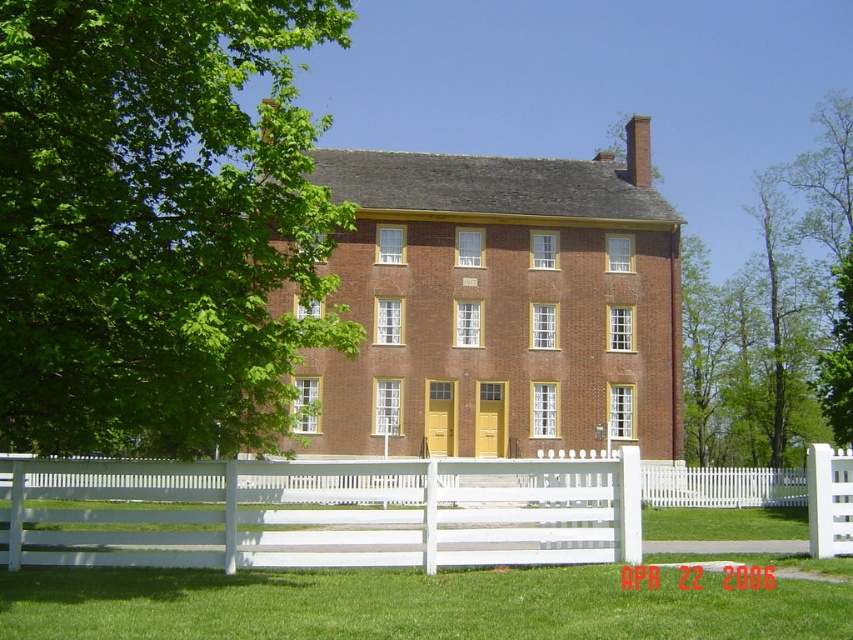
Looking at this image, you are standing in front of the building and want to take a photo that includes both the green leafy tree at left and the white wooden fence at lower center. Given that the camera can only capture objects within a 10m field of view, will both objects fit in the frame?

The green leafy tree at left is bigger than the white wooden fence at lower center, but the question of whether they fit within a 10m field of view requires knowing their actual sizes or distances. Since the description doesn

You are standing at the point with coordinates point (70,403) and want to walk towards the building. Will you pass by point (216,547) before reaching the building?

Since point (70,403) is in front of point (216,547), walking towards the building from point (70,403) would mean you are moving away from point (216,547). Therefore, you will not pass by point (216,547) before reaching the building.